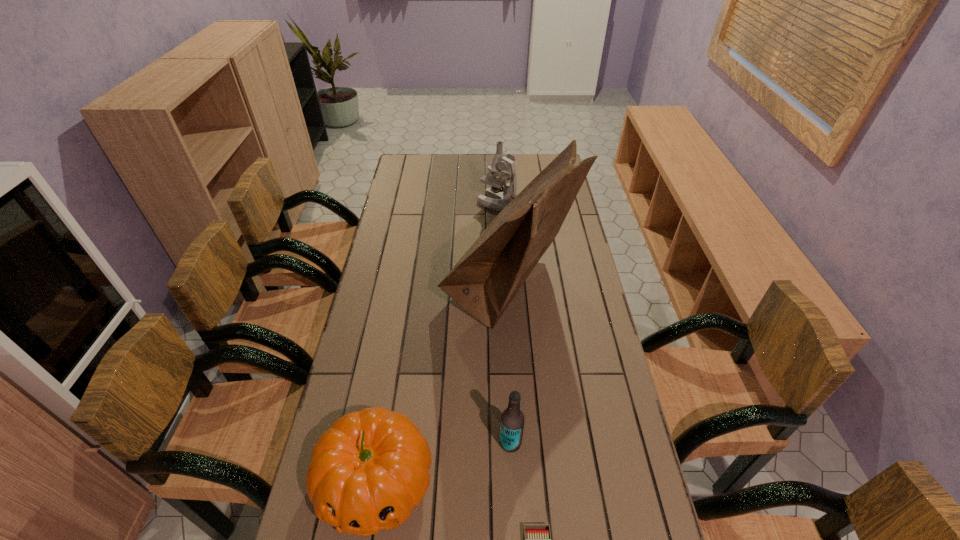
Identify the location of the tallest object. The image size is (960, 540). [485, 280].

Where is `the fourth nearest object`? the fourth nearest object is located at coordinates (485, 280).

Locate an element on the screen. The height and width of the screenshot is (540, 960). the farthest object is located at coordinates 495,198.

Image resolution: width=960 pixels, height=540 pixels. Find the location of `microscope`. microscope is located at coordinates (495, 198).

Identify the location of beer bottle. The height and width of the screenshot is (540, 960). (512, 419).

I want to click on vacant space situated 0.300m on the back of the tallest object, so click(502, 198).

This screenshot has width=960, height=540. What are the coordinates of `vacant space situated 0.320m on the back of the farthest object` in the screenshot? It's located at pos(495,158).

Locate an element on the screen. Image resolution: width=960 pixels, height=540 pixels. free space located 0.080m on the label of the beer bottle is located at coordinates (468, 442).

I want to click on vacant position located 0.130m on the label of the beer bottle, so click(x=449, y=442).

Find the location of a particular element. This screenshot has width=960, height=540. vacant space located 0.060m on the label of the beer bottle is located at coordinates (476, 442).